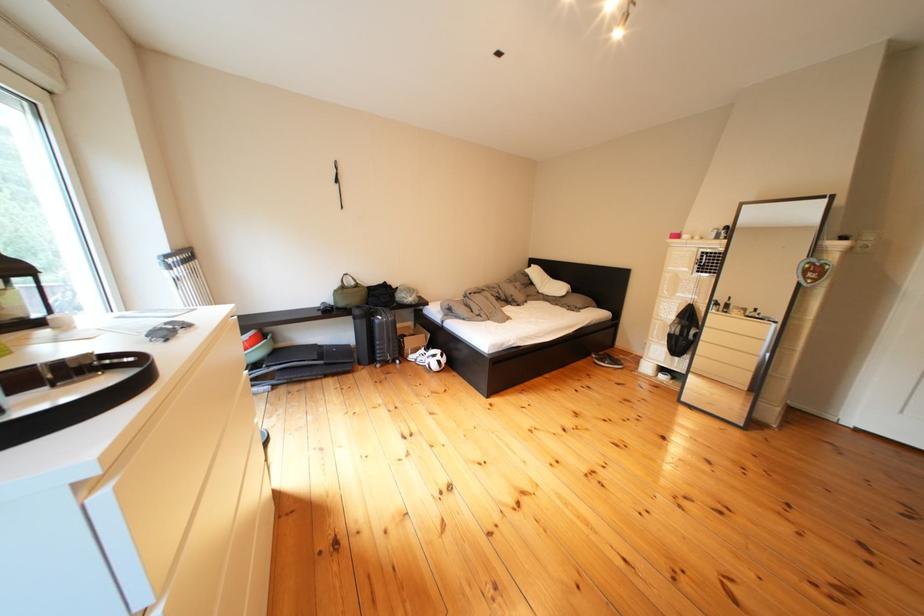
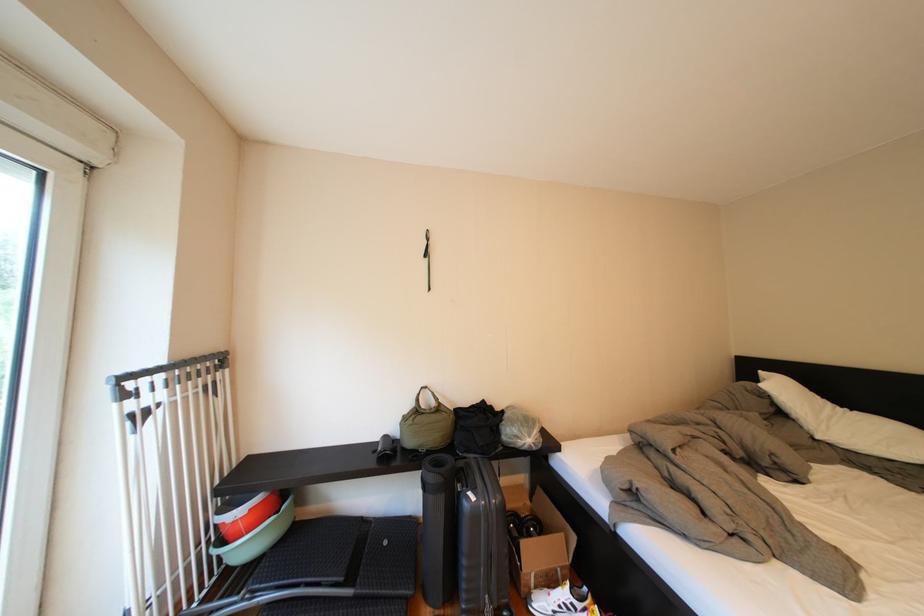
Where in the second image is the point corresponding to point 427,361 from the first image?

(554, 609)